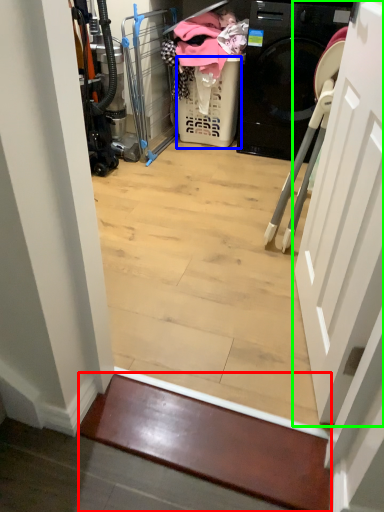
Question: Which object is positioned farthest from stairwell (highlighted by a red box)? Select from basket (highlighted by a blue box) and door (highlighted by a green box).

Choices:
 (A) basket
 (B) door

Answer: (A)